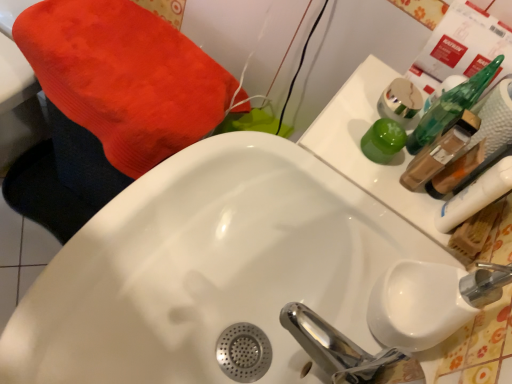
Image resolution: width=512 pixels, height=384 pixels. What are the coordinates of `free space in front of green glossy cup at upper right, arranged as the second mouthwash when viewed from the top` in the screenshot? It's located at (362, 199).